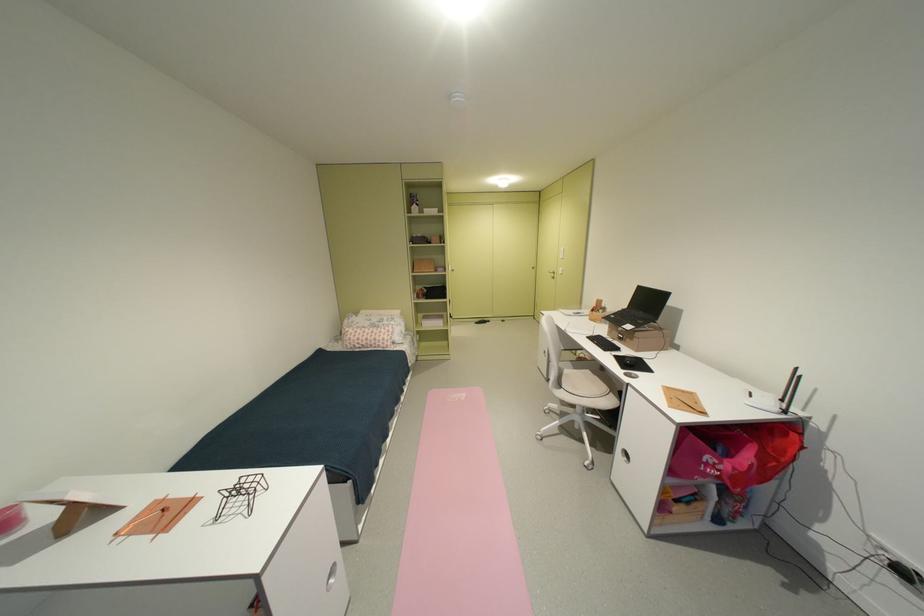
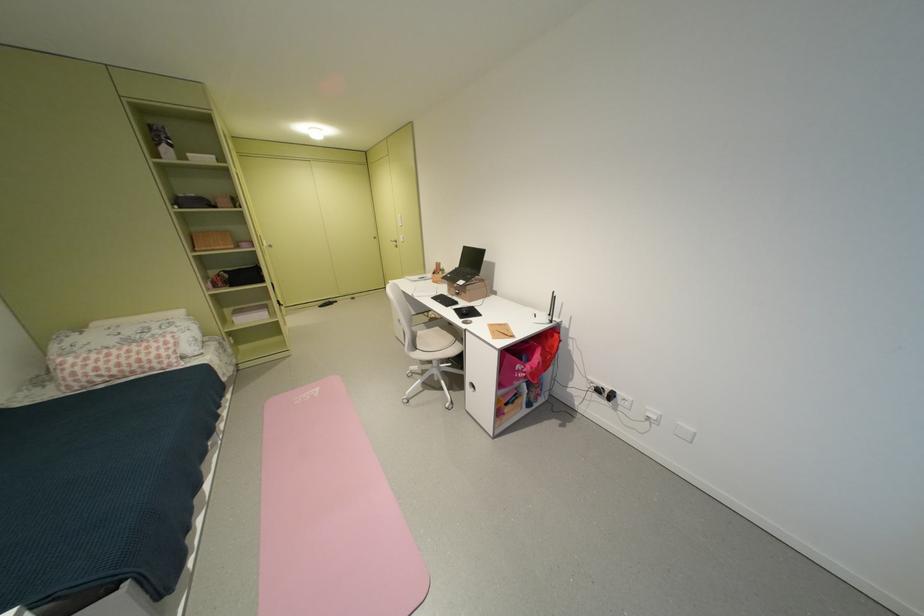
The point at (573,387) is marked in the first image. Where is the corresponding point in the second image?

(428, 349)